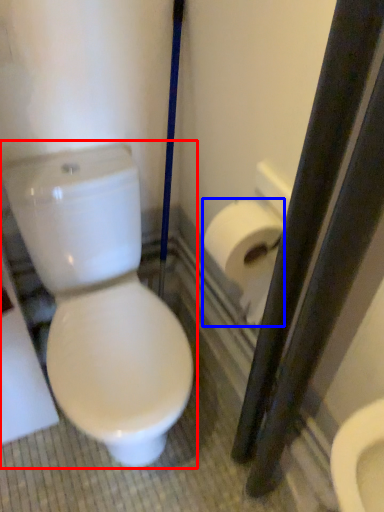
Question: Which object is closer to the camera taking this photo, toilet (highlighted by a red box) or toilet paper (highlighted by a blue box)?

Choices:
 (A) toilet
 (B) toilet paper

Answer: (A)